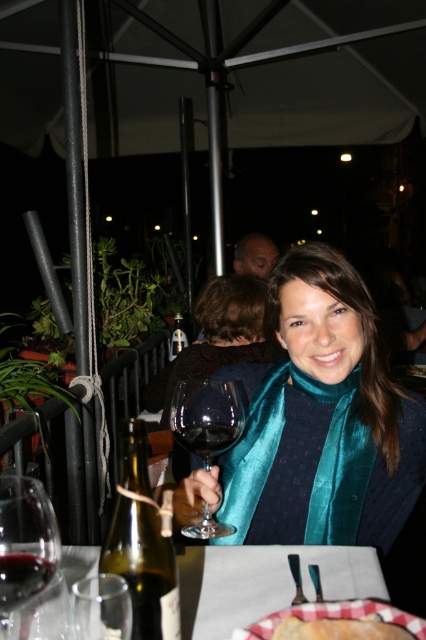
Question: Does translucent glass wine at lower left appear on the right side of transparent glass at center?

Choices:
 (A) no
 (B) yes

Answer: (B)

Question: Can you confirm if green glass bottle at lower left is bigger than golden crispy bread at lower center?

Choices:
 (A) no
 (B) yes

Answer: (B)

Question: Which of the following is the closest to the observer?

Choices:
 (A) (215, 584)
 (B) (175, 332)
 (C) (394, 628)
 (D) (158, 531)

Answer: (C)

Question: Is green glass bottle at lower left to the right of golden crispy bread at lower center from the viewer's perspective?

Choices:
 (A) yes
 (B) no

Answer: (B)

Question: Which object appears closest to the camera in this image?

Choices:
 (A) golden crispy bread at lower center
 (B) translucent glass bottle at center
 (C) transparent glass at center
 (D) translucent glass wine at lower left

Answer: (A)

Question: Which point is farther to the camera?

Choices:
 (A) (230, 422)
 (B) (181, 317)
 (C) (331, 630)
 (D) (108, 604)

Answer: (B)